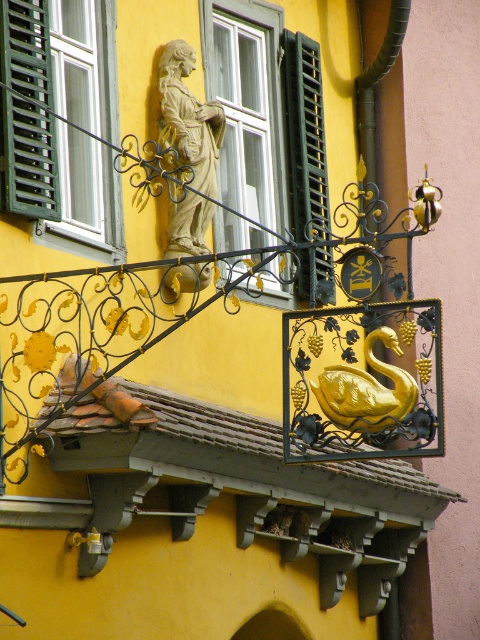
Question: Can you confirm if black matte shutter at upper center is positioned below green matte shutter at left?

Choices:
 (A) yes
 (B) no

Answer: (B)

Question: Which point is closer to the camera?

Choices:
 (A) green matte shutter at upper left
 (B) stone statue at center
 (C) black matte shutter at upper center

Answer: (A)

Question: Which point is farther to the camera?

Choices:
 (A) gold metallic swan at center
 (B) black matte shutter at upper center
 (C) stone statue at center
 (D) green matte wooden shutter at center

Answer: (B)

Question: Can you confirm if green matte shutter at upper left is thinner than green matte shutter at left?

Choices:
 (A) no
 (B) yes

Answer: (A)

Question: Can you confirm if green matte shutter at upper left is positioned to the right of green matte wooden shutter at center?

Choices:
 (A) yes
 (B) no

Answer: (B)

Question: Estimate the real-world distances between objects in this image. Which object is closer to the black matte shutter at upper center?

Choices:
 (A) stone statue at center
 (B) green matte shutter at left
 (C) green matte wooden shutter at center

Answer: (C)